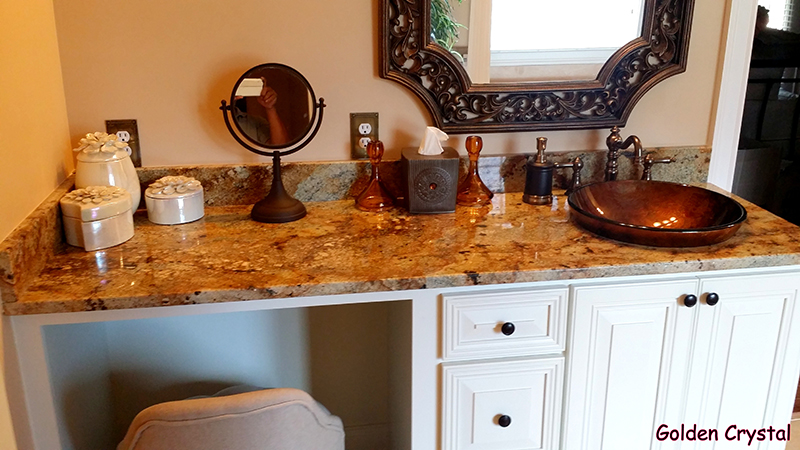
This screenshot has height=450, width=800. In order to click on drawers in this screenshot , I will do `click(460, 329)`, `click(472, 404)`.